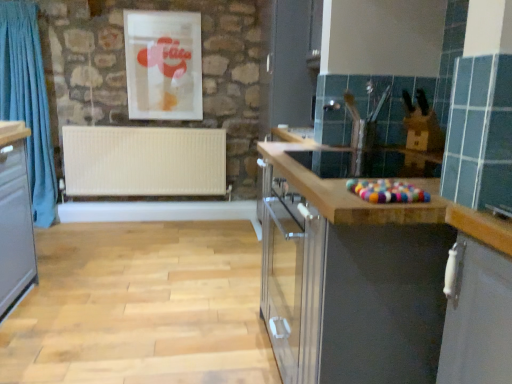
Question: Looking at the image, does matte wood countertop at center seem bigger or smaller compared to blue fabric curtain at left?

Choices:
 (A) small
 (B) big

Answer: (B)

Question: From the image's perspective, relative to blue fabric curtain at left, is matte wood countertop at center above or below?

Choices:
 (A) below
 (B) above

Answer: (A)

Question: Which object is positioned farthest from the blue fabric curtain at left?

Choices:
 (A) matte plastic picture frame at upper center
 (B) white matte radiator at center
 (C) matte wood countertop at center

Answer: (C)

Question: Based on their relative distances, which object is farther from the matte plastic picture frame at upper center?

Choices:
 (A) white matte radiator at center
 (B) matte wood countertop at center
 (C) blue fabric curtain at left

Answer: (B)